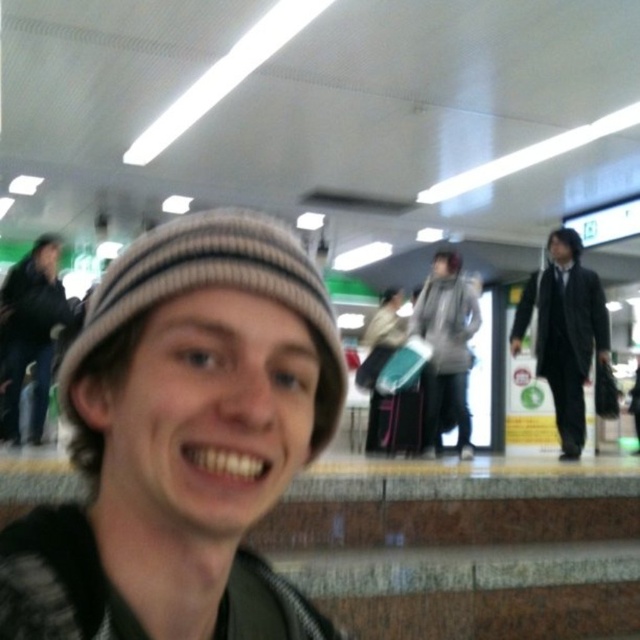
Question: Which point is closer to the camera taking this photo?

Choices:
 (A) (460, 305)
 (B) (586, 356)
 (C) (19, 332)

Answer: (B)

Question: Which object is closer to the camera taking this photo?

Choices:
 (A) knitted woolen hat at center
 (B) black suit at right
 (C) knit cap at center
 (D) dark gray knit hat at left

Answer: (C)

Question: Is the position of black suit at right less distant than that of dark gray knit hat at left?

Choices:
 (A) no
 (B) yes

Answer: (B)

Question: Which point is farther to the camera?

Choices:
 (A) (51, 252)
 (B) (573, 397)
 (C) (372, 404)

Answer: (C)

Question: Considering the relative positions of dark gray knit hat at left and gray wool scarf at center in the image provided, where is dark gray knit hat at left located with respect to gray wool scarf at center?

Choices:
 (A) left
 (B) right

Answer: (A)

Question: Can you confirm if knitted woolen hat at center is positioned below knitted beige scarf at center?

Choices:
 (A) no
 (B) yes

Answer: (A)